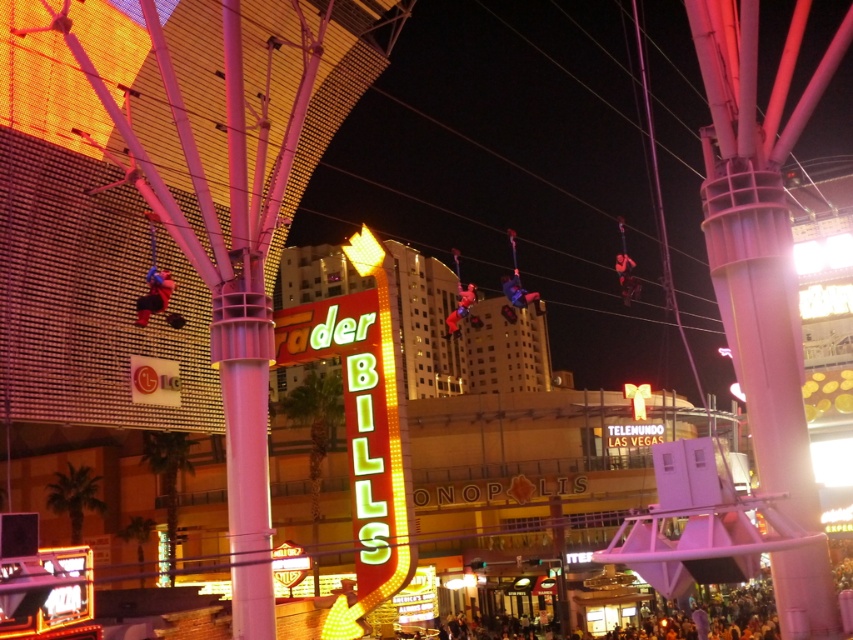
Is matte blue suit at left bigger than red fabric superhero at center?

No.

The width and height of the screenshot is (853, 640). I want to click on matte blue suit at left, so click(x=154, y=294).

Where is `matte blue suit at left`? matte blue suit at left is located at coordinates (154, 294).

Between matte black crowd at lower center and metallic blue suit at center, which one has more height?

matte black crowd at lower center is taller.

Is matte black crowd at lower center to the right of metallic blue suit at center from the viewer's perspective?

Indeed, matte black crowd at lower center is positioned on the right side of metallic blue suit at center.

Describe the element at coordinates (688, 609) in the screenshot. I see `matte black crowd at lower center` at that location.

The width and height of the screenshot is (853, 640). Find the location of `matte black crowd at lower center`. matte black crowd at lower center is located at coordinates (688, 609).

Find the location of `red fabric superhero at center`. red fabric superhero at center is located at coordinates (460, 308).

I want to click on red fabric superhero at center, so click(460, 308).